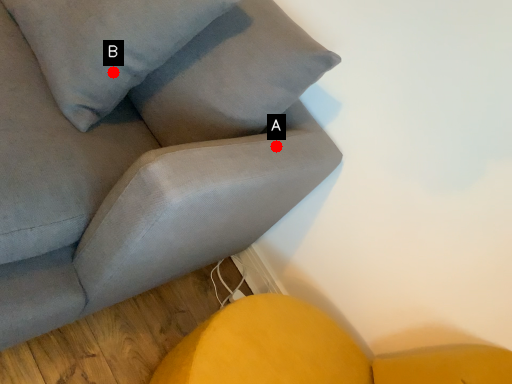
Question: Two points are circled on the image, labeled by A and B beside each circle. Which point is closer to the camera?

Choices:
 (A) A is closer
 (B) B is closer

Answer: (B)